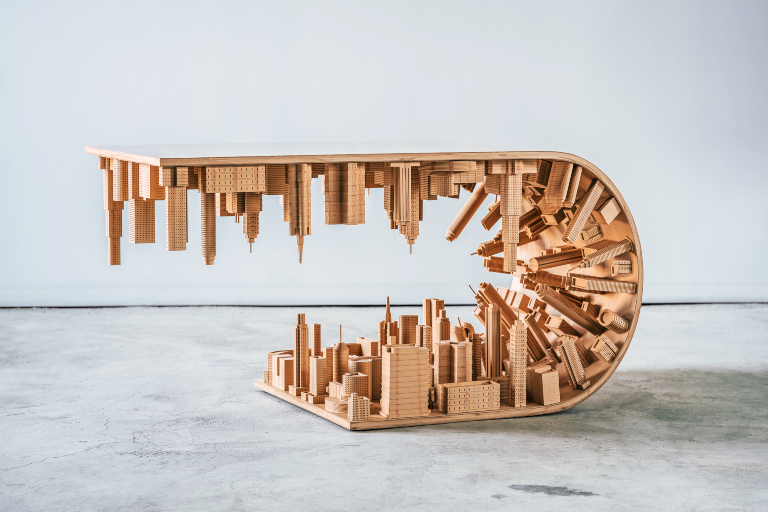
Where is `counter`? This screenshot has width=768, height=512. counter is located at coordinates (696, 472).